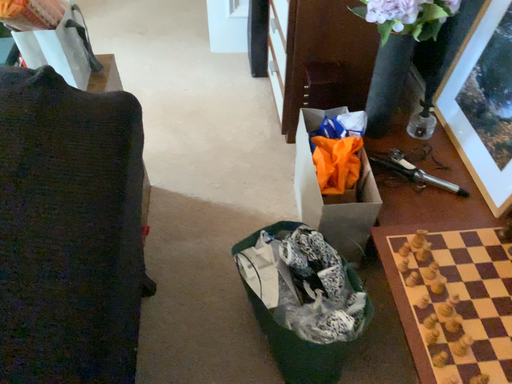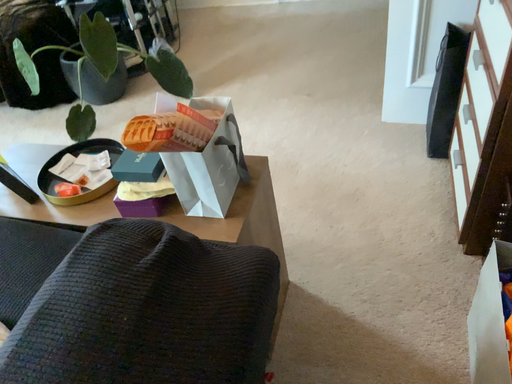
Question: How did the camera likely rotate when shooting the video?

Choices:
 (A) rotated left
 (B) rotated right

Answer: (A)